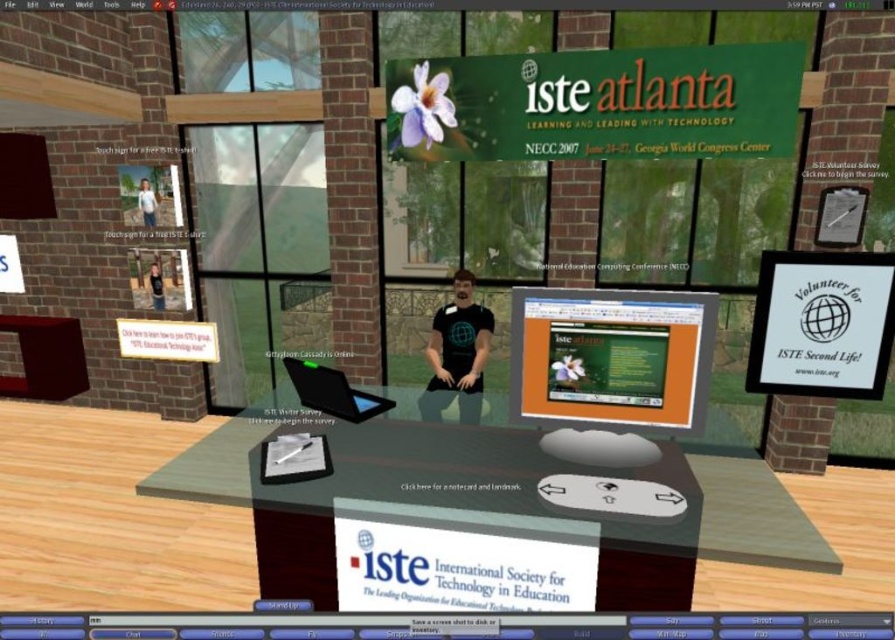
You are standing in the virtual booth and need to locate the matte orange monitor at center. Can you describe its position relative to the edges of the image?

The matte orange monitor at center is positioned at the coordinates 0.561 along the horizontal axis and 0.684 along the vertical axis relative to the image edges.